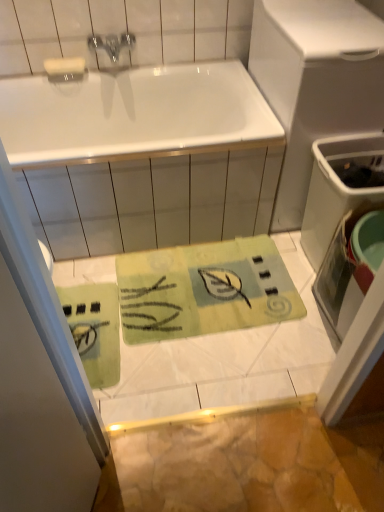
Question: From the image's perspective, is white glossy bathtub at upper center located beneath white matte bar of soap at upper left?

Choices:
 (A) yes
 (B) no

Answer: (A)

Question: Is white glossy bathtub at upper center not close to white matte bar of soap at upper left?

Choices:
 (A) yes
 (B) no

Answer: (B)

Question: Could you tell me if white glossy bathtub at upper center is turned towards white matte bar of soap at upper left?

Choices:
 (A) no
 (B) yes

Answer: (A)

Question: From the image's perspective, does white glossy bathtub at upper center appear higher than white matte bar of soap at upper left?

Choices:
 (A) yes
 (B) no

Answer: (B)

Question: Can you confirm if white glossy bathtub at upper center is shorter than white matte bar of soap at upper left?

Choices:
 (A) yes
 (B) no

Answer: (B)

Question: Considering the relative sizes of white glossy bathtub at upper center and white matte bar of soap at upper left in the image provided, is white glossy bathtub at upper center wider than white matte bar of soap at upper left?

Choices:
 (A) no
 (B) yes

Answer: (B)

Question: From the image's perspective, is metallic faucet at upper center on green fabric mat at upper center?

Choices:
 (A) no
 (B) yes

Answer: (B)

Question: Considering the relative sizes of metallic faucet at upper center and green fabric mat at upper center in the image provided, is metallic faucet at upper center taller than green fabric mat at upper center?

Choices:
 (A) no
 (B) yes

Answer: (A)

Question: Is metallic faucet at upper center smaller than green fabric mat at upper center?

Choices:
 (A) yes
 (B) no

Answer: (A)

Question: From a real-world perspective, is metallic faucet at upper center on green fabric mat at upper center?

Choices:
 (A) yes
 (B) no

Answer: (A)

Question: Is green fabric mat at upper center a part of metallic faucet at upper center?

Choices:
 (A) no
 (B) yes

Answer: (A)

Question: Considering the relative positions of metallic faucet at upper center and green fabric mat at upper center in the image provided, is metallic faucet at upper center to the left of green fabric mat at upper center from the viewer's perspective?

Choices:
 (A) yes
 (B) no

Answer: (A)

Question: From a real-world perspective, is green fabric mat at upper center physically above white glossy bathtub at upper center?

Choices:
 (A) no
 (B) yes

Answer: (B)